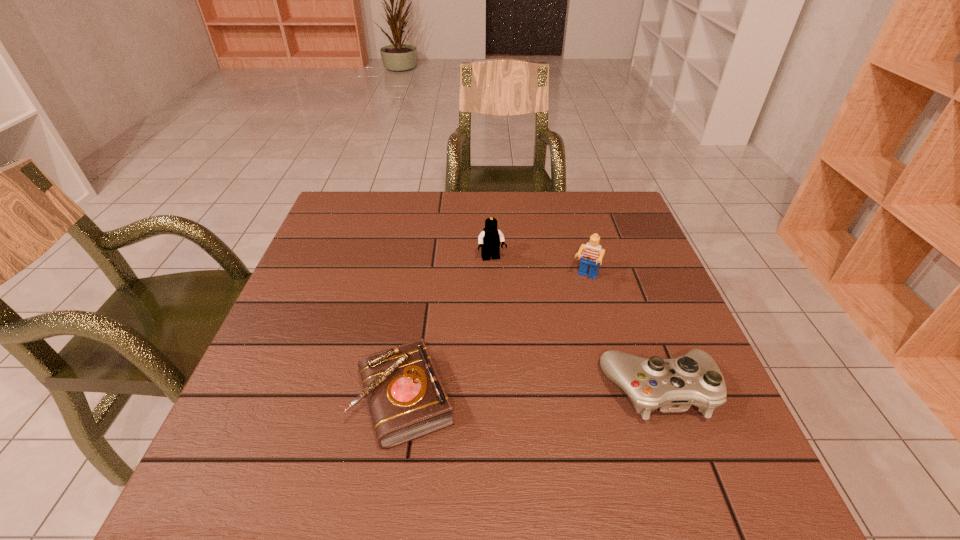
Find the location of `vacant area situated on the front-facing side of the farthest object`. vacant area situated on the front-facing side of the farthest object is located at coordinates (523, 352).

This screenshot has height=540, width=960. What are the coordinates of `free location located on the front-facing side of the farthest object` in the screenshot? It's located at (532, 379).

I want to click on vacant space located 0.220m on the face of the second farthest object, so click(553, 353).

Find the location of `free space located on the face of the second farthest object`. free space located on the face of the second farthest object is located at coordinates (575, 301).

Identify the location of vacant space located 0.330m on the face of the second farthest object. (536, 394).

Find the location of `diary positioned at the near edge`. diary positioned at the near edge is located at coordinates (407, 400).

At what (x,y) coordinates should I click in order to perform the action: click on control that is at the near edge. Please return your answer as a coordinate pair (x, y). This screenshot has height=540, width=960. Looking at the image, I should click on (672, 385).

Where is `control present at the right edge`? This screenshot has width=960, height=540. control present at the right edge is located at coordinates point(672,385).

This screenshot has height=540, width=960. Find the location of `Lego that is at the right edge`. Lego that is at the right edge is located at coordinates (592, 256).

You are a GUI agent. You are given a task and a screenshot of the screen. Output one action in this format:
    pyautogui.click(x=<x>, y=<y>)
    Task: Click on the object located at the near right corner
    The height and width of the screenshot is (540, 960).
    Given the screenshot: What is the action you would take?
    pyautogui.click(x=672, y=385)